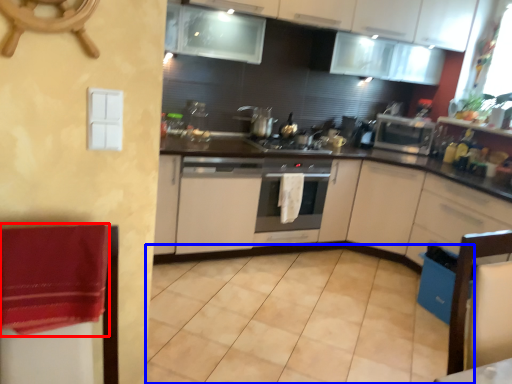
Question: Which object appears farthest to the camera in this image, blanket (highlighted by a red box) or tile (highlighted by a blue box)?

Choices:
 (A) blanket
 (B) tile

Answer: (B)